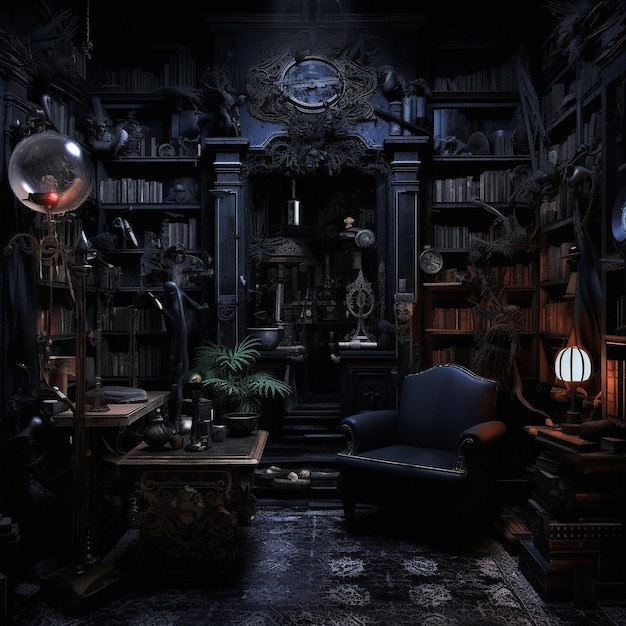
This screenshot has width=626, height=626. Find the location of `rug`. rug is located at coordinates (317, 573).